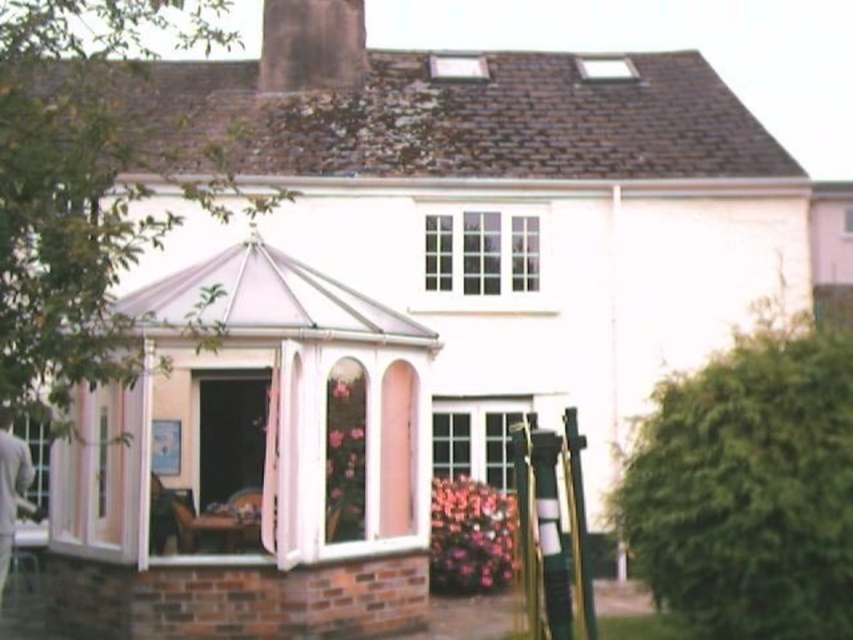
Where is `white glass bay window at upper center`? The width and height of the screenshot is (853, 640). white glass bay window at upper center is located at coordinates (480, 252).

Between point (515, 227) and point (277, 52), which one is positioned in front?

Point (515, 227) is in front.

Image resolution: width=853 pixels, height=640 pixels. Find the location of `white glass bay window at upper center`. white glass bay window at upper center is located at coordinates (480, 252).

Which is behind, point (260, 620) or point (283, 20)?

The point (283, 20) is behind.

Is pink glass gazebo at left shorter than dark gray stone chimney at upper center?

In fact, pink glass gazebo at left may be taller than dark gray stone chimney at upper center.

Image resolution: width=853 pixels, height=640 pixels. I want to click on pink glass gazebo at left, so click(254, 465).

Locate an element on the screen. pink glass gazebo at left is located at coordinates (254, 465).

Does pink glass gazebo at left have a larger size compared to white glass bay window at upper center?

Yes, pink glass gazebo at left is bigger than white glass bay window at upper center.

Can you confirm if pink glass gazebo at left is taller than white glass bay window at upper center?

Indeed, pink glass gazebo at left has a greater height compared to white glass bay window at upper center.

Between point (340, 365) and point (444, 234), which one is positioned behind?

Point (444, 234)

In order to click on pink glass gazebo at left in this screenshot , I will do `click(254, 465)`.